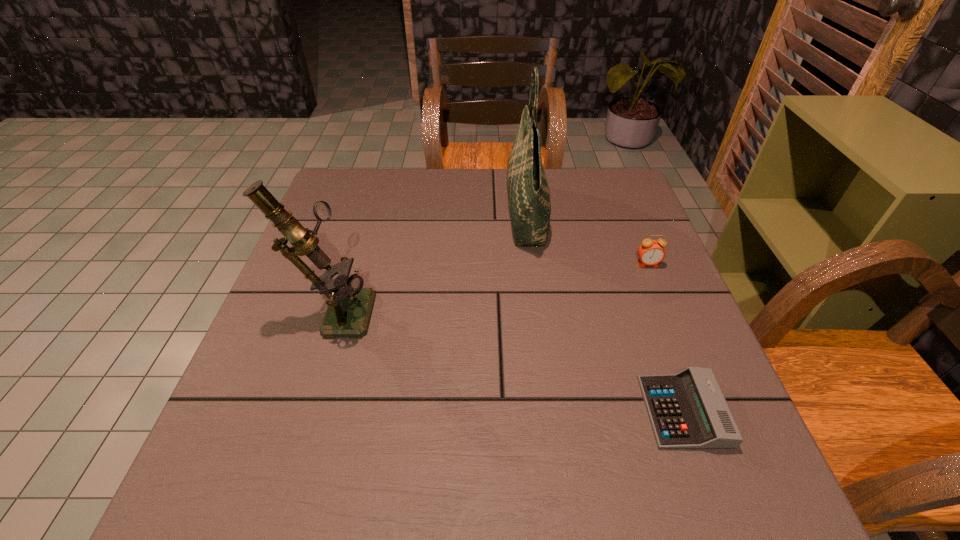
What are the coordinates of `vacant area situated on the face of the alarm clock` in the screenshot? It's located at (684, 354).

Locate an element on the screen. free spot located 0.130m on the left of the nearest object is located at coordinates (574, 411).

Locate an element on the screen. object positioned at the far edge is located at coordinates (528, 192).

Locate an element on the screen. The height and width of the screenshot is (540, 960). object positioned at the left edge is located at coordinates (349, 308).

The width and height of the screenshot is (960, 540). Find the location of `alarm clock at the right edge`. alarm clock at the right edge is located at coordinates point(651,252).

You are a GUI agent. You are given a task and a screenshot of the screen. Output one action in this format:
    pyautogui.click(x=<x>, y=<y>)
    Task: Click on the calculator that is at the right edge
    This screenshot has height=540, width=960.
    Given the screenshot: What is the action you would take?
    pyautogui.click(x=687, y=410)

In the image, there is a desktop. Where is `vacant space at the far edge`? The height and width of the screenshot is (540, 960). vacant space at the far edge is located at coordinates (493, 204).

The width and height of the screenshot is (960, 540). In the image, there is a desktop. What are the coordinates of `free space at the left edge` in the screenshot? It's located at (294, 429).

In the image, there is a desktop. Where is `free region at the right edge`? free region at the right edge is located at coordinates (601, 226).

In order to click on free space at the far left corner of the desktop in this screenshot , I will do `click(356, 190)`.